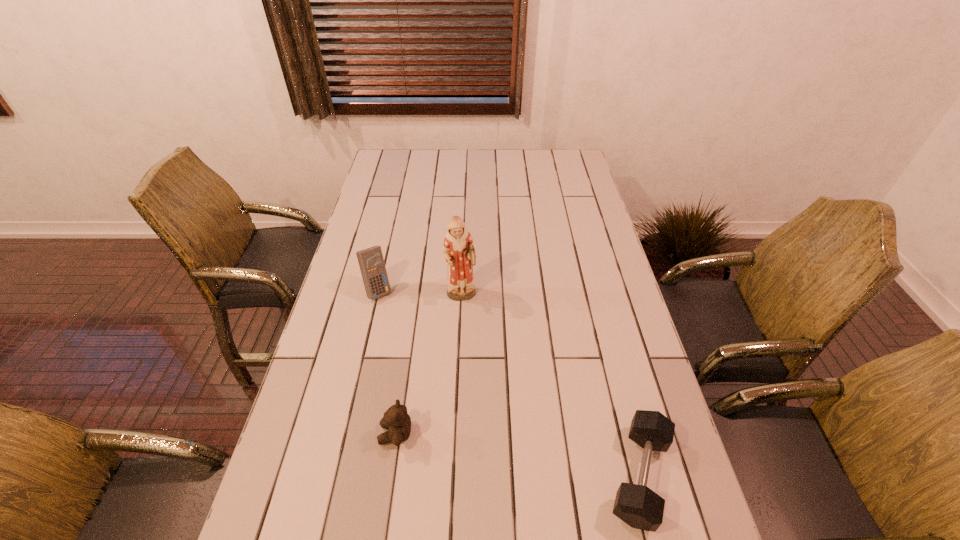
I want to click on the third object from right to left, so click(x=396, y=420).

You are a GUI agent. You are given a task and a screenshot of the screen. Output one action in this format:
    pyautogui.click(x=<x>, y=<y>)
    Task: Click on the teddy bear
    Image resolution: width=960 pixels, height=540 pixels.
    Given the screenshot: What is the action you would take?
    coord(396,420)

The height and width of the screenshot is (540, 960). I want to click on the rightmost object, so click(x=638, y=506).

Locate an element on the screen. Image resolution: width=960 pixels, height=540 pixels. dumbbell is located at coordinates (638, 506).

You are a GUI agent. You are given a task and a screenshot of the screen. Output one action in this format:
    pyautogui.click(x=<x>, y=<y>)
    Task: Click on the tallest object
    This screenshot has width=960, height=540.
    Given the screenshot: What is the action you would take?
    [458, 249]

Find the location of a particular element. the third object from left to right is located at coordinates point(458,249).

Where is `the leftmost object`? Image resolution: width=960 pixels, height=540 pixels. the leftmost object is located at coordinates (371, 262).

The image size is (960, 540). In order to click on the third shortest object in this screenshot , I will do `click(371, 262)`.

Identify the location of free space located on the face of the second shortest object. This screenshot has width=960, height=540. (358, 434).

This screenshot has height=540, width=960. What are the coordinates of `vacant area located 0.070m on the face of the second shortest object` in the screenshot? It's located at (349, 434).